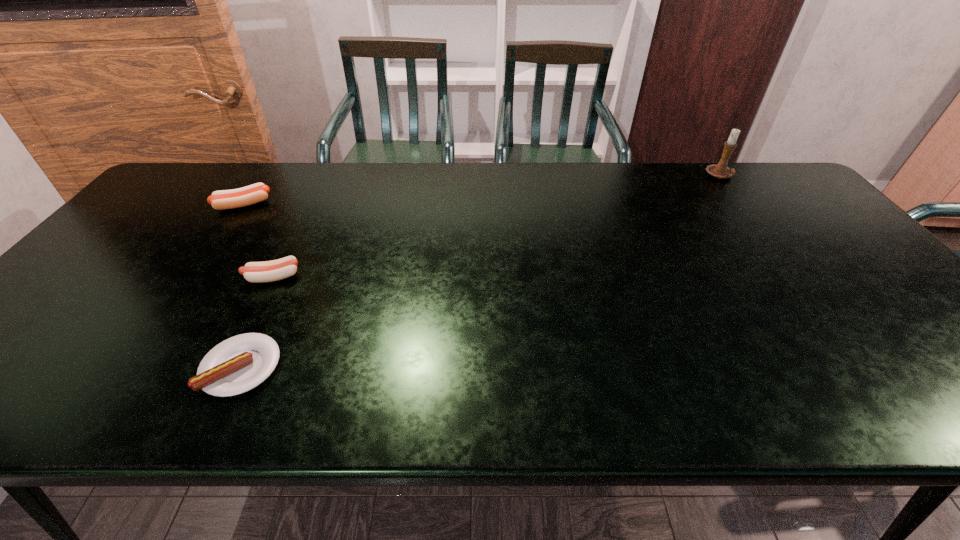
What are the coordinates of `free space located on the right of the shortest object` in the screenshot? It's located at (463, 367).

The image size is (960, 540). What are the coordinates of `candle holder that is at the far edge` in the screenshot? It's located at click(721, 171).

Where is `sausage present at the far edge`? Image resolution: width=960 pixels, height=540 pixels. sausage present at the far edge is located at coordinates (224, 199).

Find the location of a particular element. object located at the near edge is located at coordinates (236, 365).

Where is `vacant region at the far edge of the desktop`? The width and height of the screenshot is (960, 540). vacant region at the far edge of the desktop is located at coordinates (277, 178).

This screenshot has height=540, width=960. Identify the location of vacant area at the near edge of the desktop. (578, 383).

This screenshot has width=960, height=540. In the image, there is a desktop. Find the location of `vacant space at the left edge`. vacant space at the left edge is located at coordinates (15, 368).

Identify the location of vacant region at the right edge of the desktop. (889, 292).

You are a GUI agent. You are given a task and a screenshot of the screen. Output one action in this format:
    pyautogui.click(x=<x>, y=<y>)
    Task: Click on the free space between the third farthest object and the candle holder
    
    Given the screenshot: What is the action you would take?
    pyautogui.click(x=496, y=227)

This screenshot has width=960, height=540. Find the location of `free spot between the rightmost object and the shortest object`. free spot between the rightmost object and the shortest object is located at coordinates (481, 272).